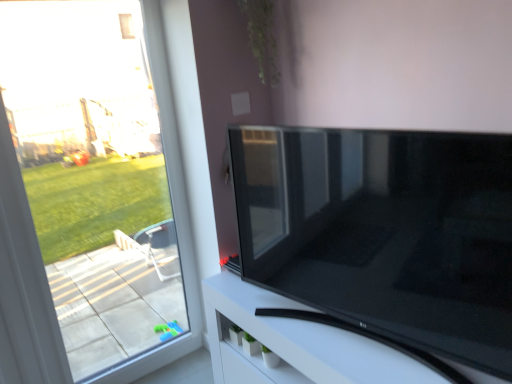
Question: In terms of width, does green matte plant at upper center look wider or thinner when compared to transparent glass window at left?

Choices:
 (A) wide
 (B) thin

Answer: (A)

Question: Based on their sizes in the image, would you say green matte plant at upper center is bigger or smaller than transparent glass window at left?

Choices:
 (A) big
 (B) small

Answer: (B)

Question: Estimate the real-world distances between objects in this image. Which object is farther from the transparent glass window at left?

Choices:
 (A) green matte plant at upper center
 (B) matte black tv at center
 (C) black glossy tv stand at lower right

Answer: (A)

Question: Which object is the farthest from the transparent glass window at left?

Choices:
 (A) black glossy tv stand at lower right
 (B) matte black tv at center
 (C) green matte plant at upper center

Answer: (C)